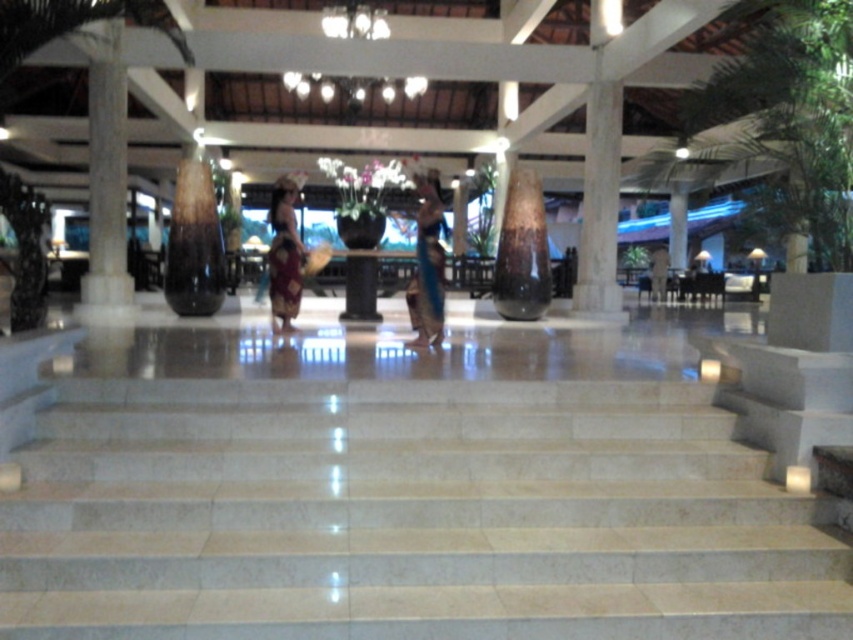
Question: In this image, where is white marble pillar at center located relative to dark brown leather jacket at center?

Choices:
 (A) right
 (B) left

Answer: (B)

Question: Among these objects, which one is farthest from the camera?

Choices:
 (A) dark brown leather jacket at center
 (B) white marble pillar at left

Answer: (A)

Question: Does beige marble stairs at center appear on the left side of matte brown pillar at right?

Choices:
 (A) yes
 (B) no

Answer: (A)

Question: Which is nearer to the white marble pillar at center?

Choices:
 (A) matte purple skirt at center
 (B) matte brown pillar at right
 (C) beige marble stairs at center
 (D) blue silk dress at center

Answer: (D)

Question: Among these points, which one is farthest from the camera?

Choices:
 (A) (672, 248)
 (B) (653, 266)

Answer: (A)

Question: Is white marble pillar at left wider than blue silk dress at center?

Choices:
 (A) yes
 (B) no

Answer: (A)